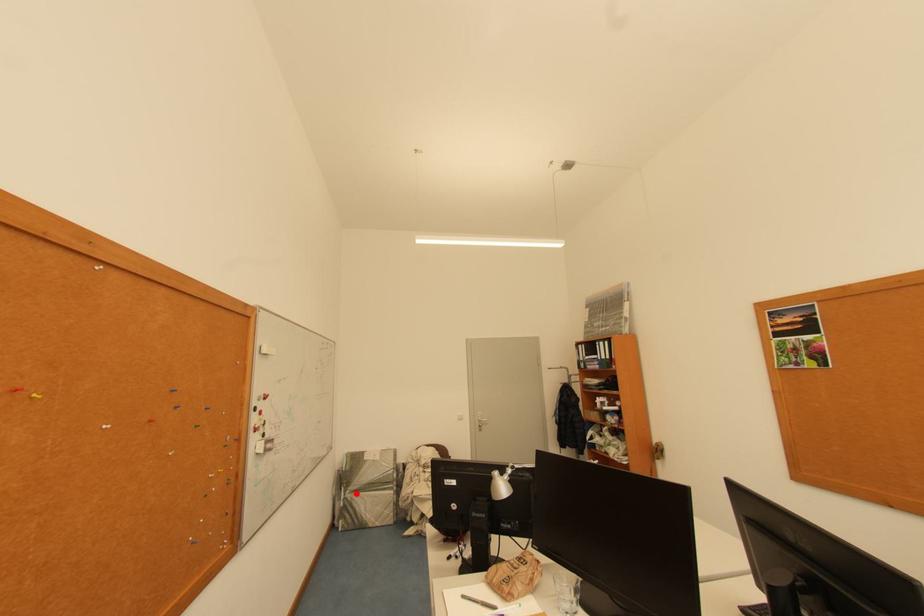
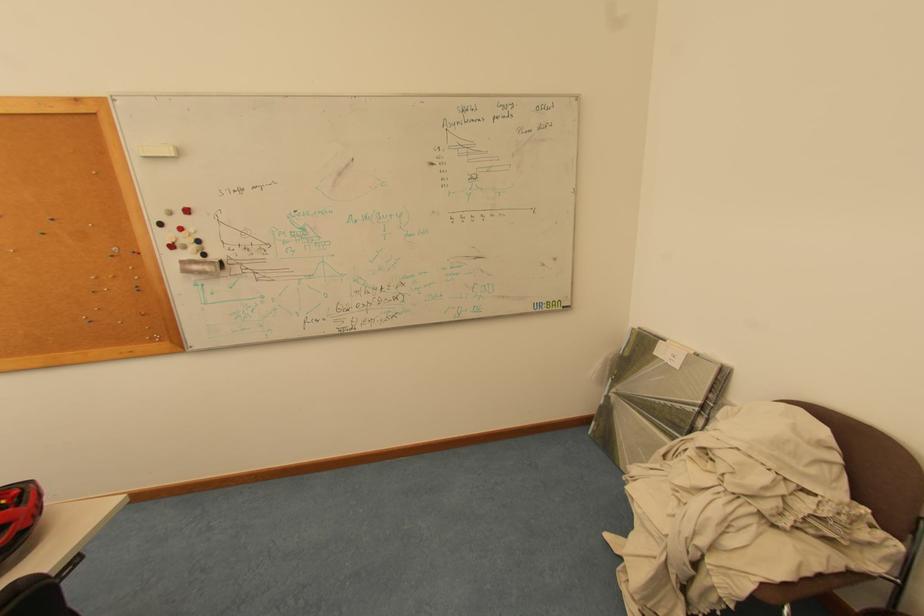
Find the pixel in the second image that matches the highlighted location in the first image.

(622, 392)